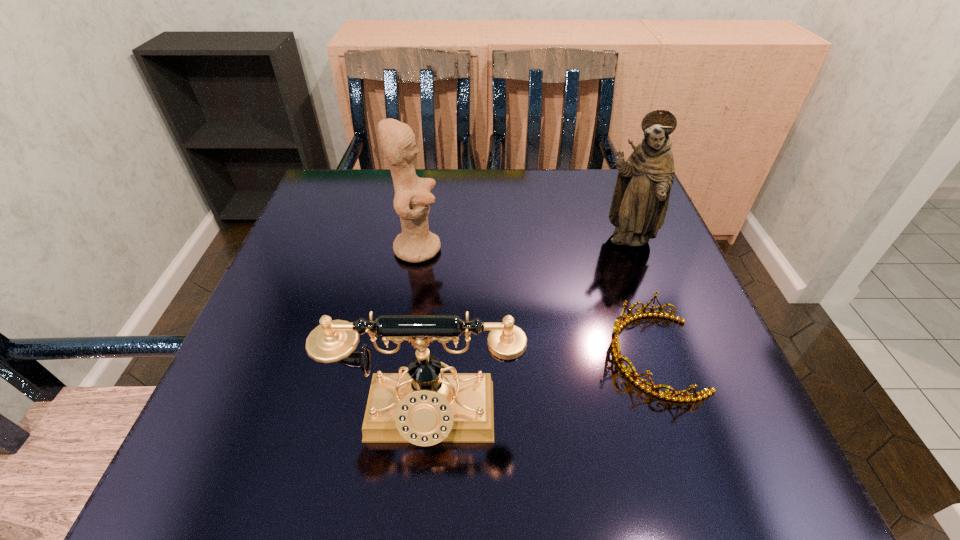
Locate an element on the screen. This screenshot has width=960, height=540. figurine present at the right edge is located at coordinates (640, 200).

Where is `tiara positioned at the right edge`? The height and width of the screenshot is (540, 960). tiara positioned at the right edge is located at coordinates (632, 375).

In the image, there is a desktop. Identify the location of vacant space at the far edge. (555, 207).

This screenshot has height=540, width=960. Identify the location of vacant space at the near edge. (372, 478).

Where is `free spot at the left edge of the desktop`? The image size is (960, 540). free spot at the left edge of the desktop is located at coordinates point(299,291).

This screenshot has width=960, height=540. I want to click on vacant space at the right edge of the desktop, so click(x=630, y=288).

Where is `free location at the far left corner of the desktop`? The width and height of the screenshot is (960, 540). free location at the far left corner of the desktop is located at coordinates (372, 217).

In the image, there is a desktop. Where is `vacant space at the near left corner`? Image resolution: width=960 pixels, height=540 pixels. vacant space at the near left corner is located at coordinates (220, 449).

In the image, there is a desktop. Identify the location of free space at the far right corner. The height and width of the screenshot is (540, 960). (612, 186).

In the image, there is a desktop. Where is `free space at the near right corner`? free space at the near right corner is located at coordinates (728, 448).